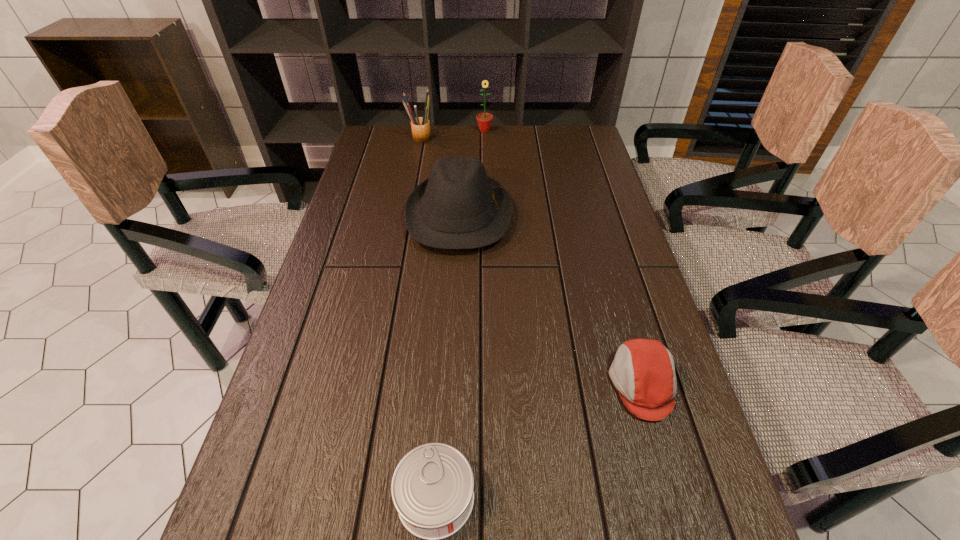
This screenshot has width=960, height=540. In order to click on free space located on the front-facing side of the rightmost object in this screenshot , I will do `click(440, 384)`.

The image size is (960, 540). In order to click on sunflower that is at the far edge in this screenshot , I will do [x=484, y=120].

Locate an element on the screen. This screenshot has width=960, height=540. pencil box that is at the far edge is located at coordinates (420, 126).

The height and width of the screenshot is (540, 960). In order to click on object that is at the left edge in this screenshot , I will do `click(420, 126)`.

Locate an element on the screen. This screenshot has height=540, width=960. object located in the right edge section of the desktop is located at coordinates (643, 371).

Where is `object that is at the far left corner`? The height and width of the screenshot is (540, 960). object that is at the far left corner is located at coordinates (420, 126).

The width and height of the screenshot is (960, 540). I want to click on vacant space at the left edge of the desktop, so (334, 237).

You are a GUI agent. You are given a task and a screenshot of the screen. Output one action in this format:
    pyautogui.click(x=<x>, y=<y>)
    Task: Click on the vacant space at the right edge
    This screenshot has height=540, width=960.
    Given the screenshot: What is the action you would take?
    pyautogui.click(x=705, y=480)

I want to click on vacant area at the far left corner, so click(x=407, y=151).

Where is `vacant space that's between the rightmost object and the pencil box`? vacant space that's between the rightmost object and the pencil box is located at coordinates (531, 261).